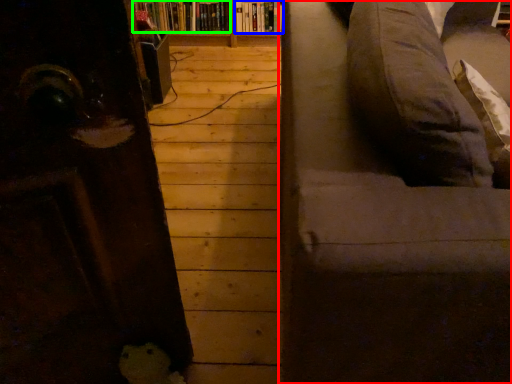
Question: Which object is the closest to the studio couch (highlighted by a red box)? Choose among these: book (highlighted by a blue box) or book (highlighted by a green box).

Choices:
 (A) book
 (B) book

Answer: (B)